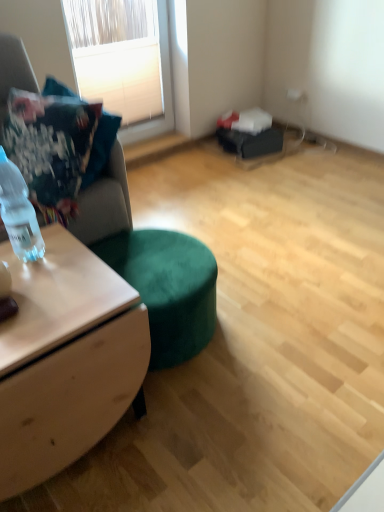
Where is `vacant space situated above wooden desk at left (from a real-world perspective)`? The height and width of the screenshot is (512, 384). vacant space situated above wooden desk at left (from a real-world perspective) is located at coordinates (54, 284).